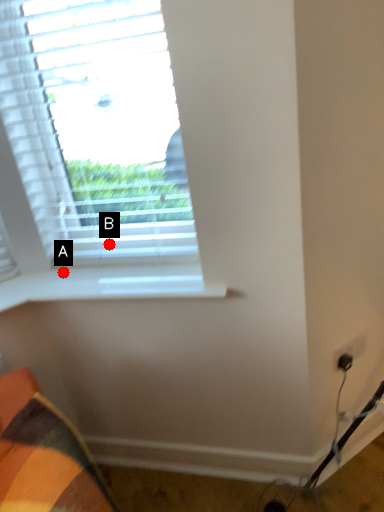
Question: Two points are circled on the image, labeled by A and B beside each circle. Which point is farther to the camera?

Choices:
 (A) A is further
 (B) B is further

Answer: (B)